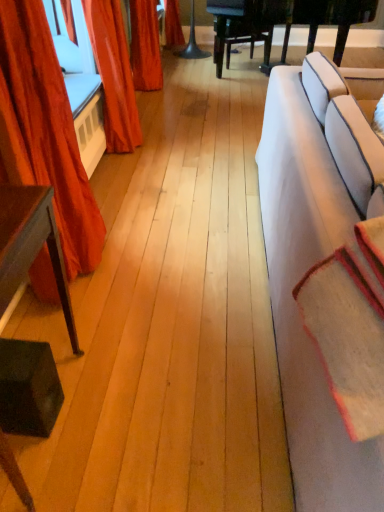
The image size is (384, 512). What are the coordinates of `free area behind dark brown wood table at left` in the screenshot? It's located at (86, 322).